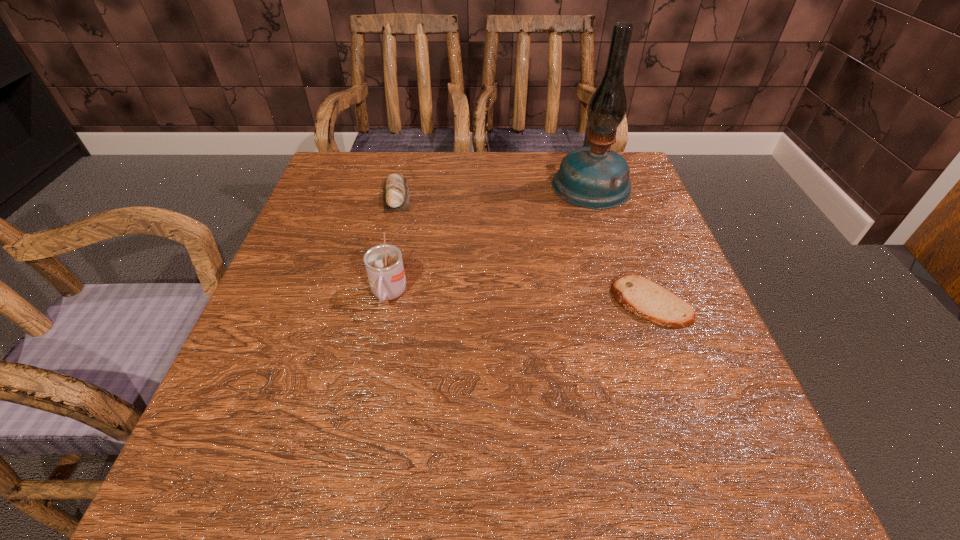
Image resolution: width=960 pixels, height=540 pixels. Find the location of `vacant area at the right edge of the desktop`. vacant area at the right edge of the desktop is located at coordinates (681, 370).

Find the location of `free space at the far left corner`. free space at the far left corner is located at coordinates (348, 159).

Locate an element on the screen. The width and height of the screenshot is (960, 540). vacant point located between the third shortest object and the third tallest object is located at coordinates (393, 245).

I want to click on unoccupied area between the left pita bread and the tallest object, so click(x=493, y=190).

Identify the location of empty location between the cup and the farther pita bread. This screenshot has width=960, height=540. (393, 245).

You are a GUI agent. You are given a task and a screenshot of the screen. Output one action in this format:
    pyautogui.click(x=<x>, y=<y>)
    Task: Click on the free spot between the tallest object and the cup
    This screenshot has width=960, height=540.
    Given the screenshot: What is the action you would take?
    pyautogui.click(x=490, y=240)

You are a GUI agent. You are given a task and a screenshot of the screen. Output one action in this format:
    pyautogui.click(x=<x>, y=<y>)
    Task: Click on the blank region between the third tallest object and the second tallest object
    This screenshot has height=540, width=960.
    Given the screenshot: What is the action you would take?
    pyautogui.click(x=393, y=245)

What are the coordinates of `blank region between the right pita bread and the farther pita bread` in the screenshot? It's located at (523, 249).

Where is `unoccupied area between the oil lamp and the cup`? unoccupied area between the oil lamp and the cup is located at coordinates (490, 240).

Where is `vacant region between the third tallest object and the cup`? The height and width of the screenshot is (540, 960). vacant region between the third tallest object and the cup is located at coordinates (393, 245).